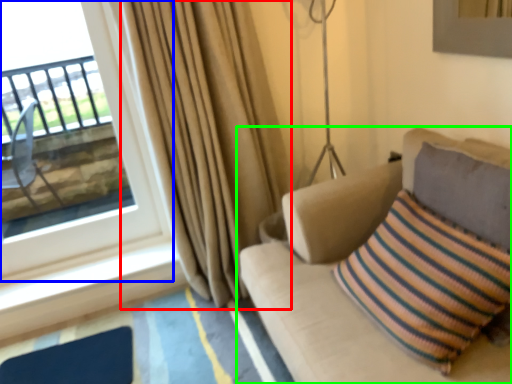
Question: Which is farther away from curtain (highlighted by a red box)? window (highlighted by a blue box) or studio couch (highlighted by a green box)?

Choices:
 (A) window
 (B) studio couch

Answer: (B)